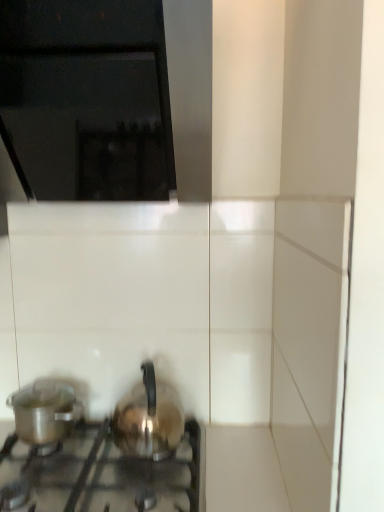
Question: Is shiny metallic kettle at center, the first kitchen appliance in the right-to-left sequence, at the left side of black glass vent at upper left?

Choices:
 (A) yes
 (B) no

Answer: (B)

Question: Considering the relative sizes of shiny metallic kettle at center, the second kitchen appliance viewed from the left, and black glass vent at upper left in the image provided, is shiny metallic kettle at center, the second kitchen appliance viewed from the left, wider than black glass vent at upper left?

Choices:
 (A) no
 (B) yes

Answer: (A)

Question: From the image's perspective, is shiny metallic kettle at center, the first kitchen appliance in the right-to-left sequence, beneath black glass vent at upper left?

Choices:
 (A) no
 (B) yes

Answer: (B)

Question: Does shiny metallic kettle at center, the second kitchen appliance viewed from the left, appear on the right side of black glass vent at upper left?

Choices:
 (A) yes
 (B) no

Answer: (A)

Question: From a real-world perspective, does shiny metallic kettle at center, the second kitchen appliance viewed from the left, sit lower than black glass vent at upper left?

Choices:
 (A) no
 (B) yes

Answer: (B)

Question: Looking at the image, does black glass vent at upper left seem bigger or smaller compared to satin silver kettle at lower left?

Choices:
 (A) small
 (B) big

Answer: (B)

Question: Considering their positions, is black glass vent at upper left located in front of or behind satin silver kettle at lower left?

Choices:
 (A) behind
 (B) front

Answer: (B)

Question: Considering the positions of black glass vent at upper left and satin silver kettle at lower left in the image, is black glass vent at upper left wider or thinner than satin silver kettle at lower left?

Choices:
 (A) thin
 (B) wide

Answer: (B)

Question: From the image's perspective, is black glass vent at upper left above or below satin silver kettle at lower left?

Choices:
 (A) above
 (B) below

Answer: (A)

Question: In terms of width, does metallic silver pot at lower left, the 2th kitchen appliance in the right-to-left sequence, look wider or thinner when compared to shiny metallic kettle at center, the first kitchen appliance in the right-to-left sequence?

Choices:
 (A) wide
 (B) thin

Answer: (B)

Question: In terms of height, does metallic silver pot at lower left, the 2th kitchen appliance in the right-to-left sequence, look taller or shorter compared to shiny metallic kettle at center, the first kitchen appliance in the right-to-left sequence?

Choices:
 (A) tall
 (B) short

Answer: (B)

Question: Is metallic silver pot at lower left, the 2th kitchen appliance in the right-to-left sequence, bigger or smaller than shiny metallic kettle at center, the first kitchen appliance in the right-to-left sequence?

Choices:
 (A) small
 (B) big

Answer: (A)

Question: From a real-world perspective, is metallic silver pot at lower left, the 2th kitchen appliance in the right-to-left sequence, positioned above or below shiny metallic kettle at center, the second kitchen appliance viewed from the left?

Choices:
 (A) above
 (B) below

Answer: (B)

Question: From a real-world perspective, is black glass vent at upper left positioned above or below shiny metallic kettle at center, the first kitchen appliance in the right-to-left sequence?

Choices:
 (A) below
 (B) above

Answer: (B)

Question: Is black glass vent at upper left bigger or smaller than shiny metallic kettle at center, the first kitchen appliance in the right-to-left sequence?

Choices:
 (A) big
 (B) small

Answer: (A)